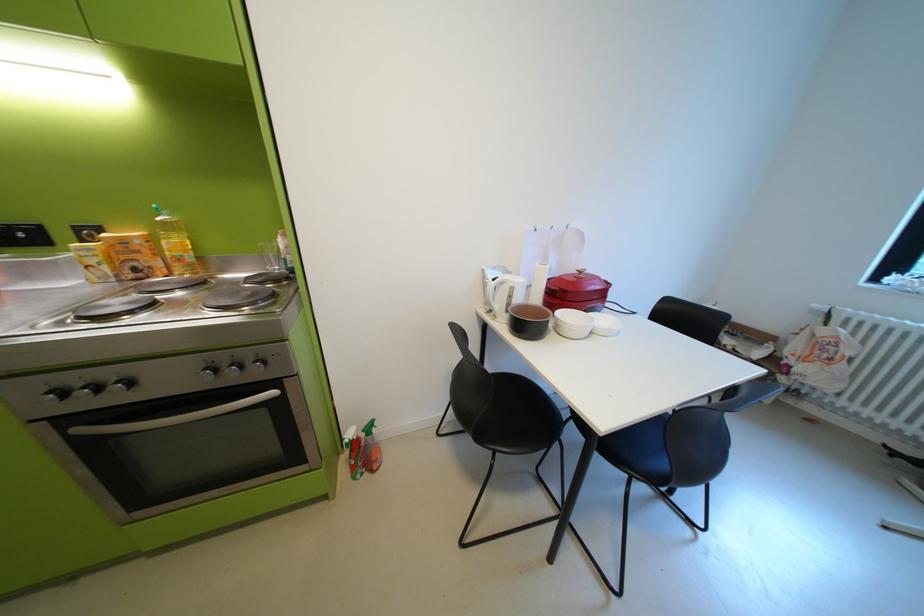
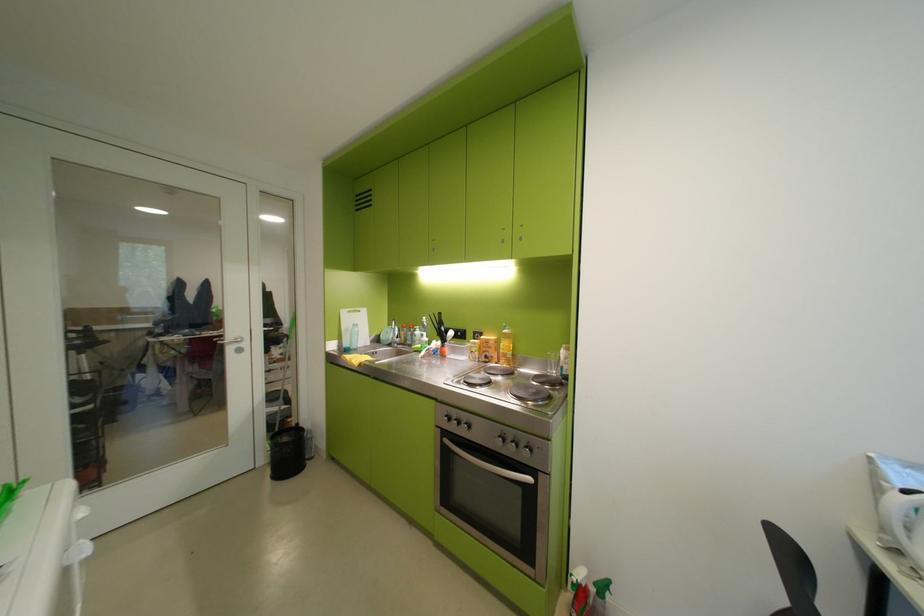
Question: The camera is either moving clockwise (left) or counter-clockwise (right) around the object. The first image is from the beginning of the video and the second image is from the end. Is the camera moving left or right when shooting the video?

Choices:
 (A) Left
 (B) Right

Answer: (B)